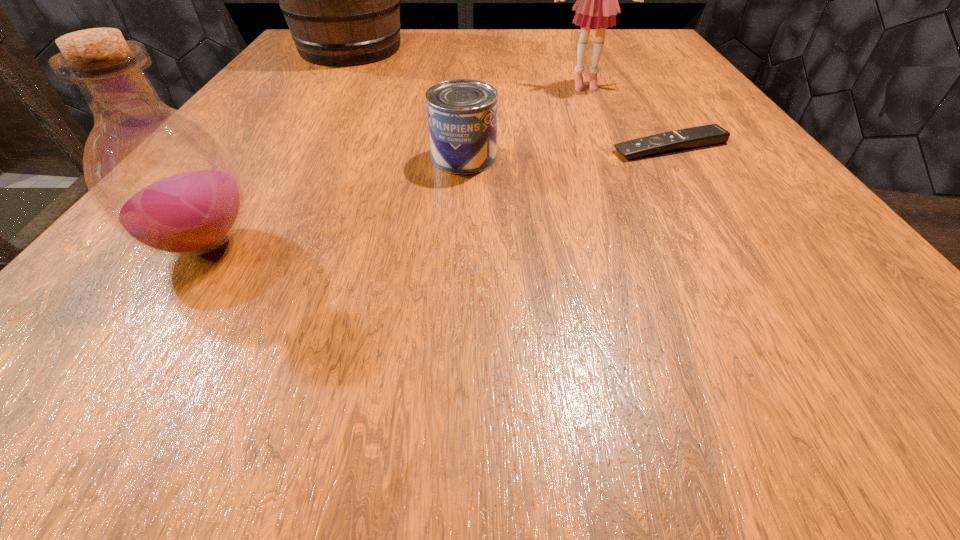
I want to click on vacant area that satisfies the following two spatial constraints: 1. on the front-facing side of the second farthest object; 2. on the left side of the remote control, so click(x=611, y=147).

The height and width of the screenshot is (540, 960). In order to click on free region that satisfies the following two spatial constraints: 1. on the front-facing side of the doll; 2. on the front label of the can in this screenshot , I will do `click(614, 157)`.

You are a GUI agent. You are given a task and a screenshot of the screen. Output one action in this format:
    pyautogui.click(x=<x>, y=<y>)
    Task: Click on the free spot that satisfies the following two spatial constraints: 1. on the front side of the tallest object; 2. on the right side of the shortest object
    
    Given the screenshot: What is the action you would take?
    pyautogui.click(x=291, y=147)